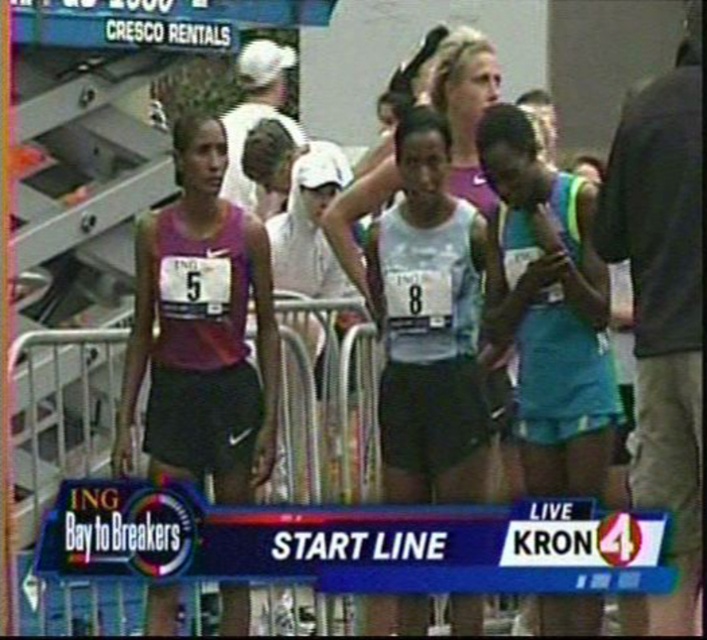
Looking at this image, you are a race organizer and need to ensure that the race bib numbers are visible. The teal fabric tank top at center and the white matte tank top at center are both in the center of the image. Which one would you check first if you want to ensure the bib number is visible, considering their sizes?

The teal fabric tank top at center is smaller than the white matte tank top at center, so you should check the teal fabric tank top at center first since smaller tops might require the bib number to be placed in a more visible position to ensure it doesn